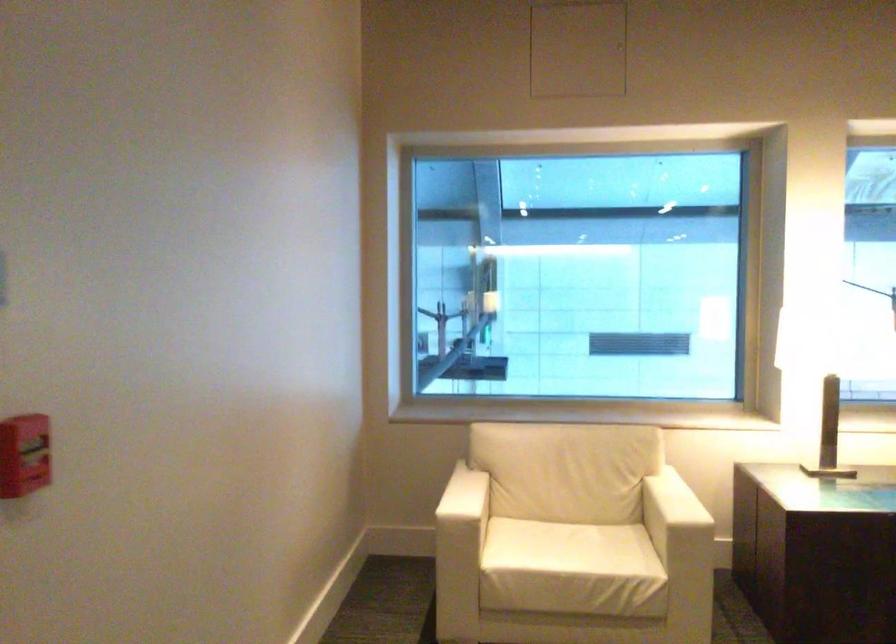
Find where to pull the red fire alarm handle. Please return your answer as a coordinate pair (x, y).

(35, 462)